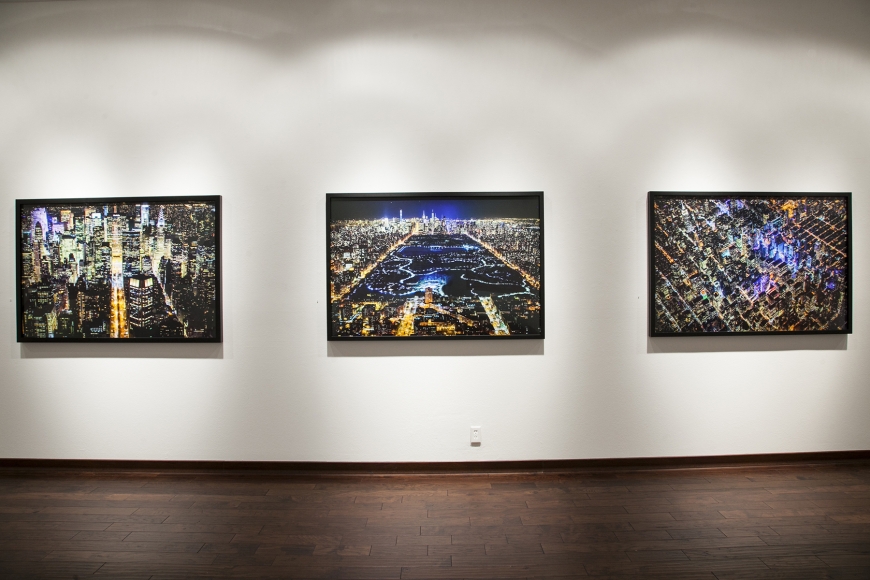
The image size is (870, 580). I want to click on last painting, so click(707, 266).